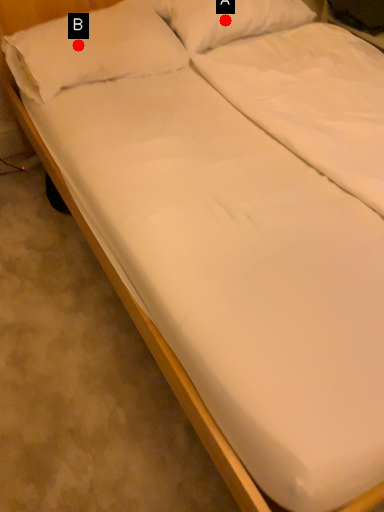
Question: Two points are circled on the image, labeled by A and B beside each circle. Which point is further to the camera?

Choices:
 (A) A is further
 (B) B is further

Answer: (A)